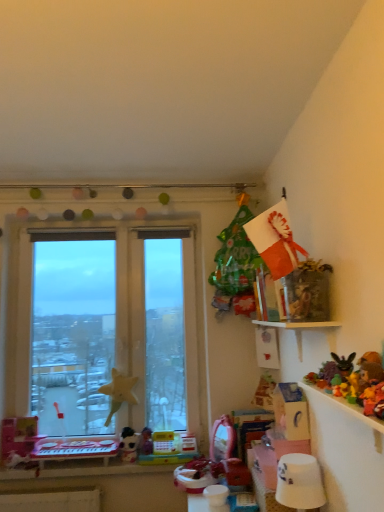
Find the location of a particular element. The image size is (384, 512). vacant space underneath white plastic table at lower left (from a real-world perspective) is located at coordinates (77, 467).